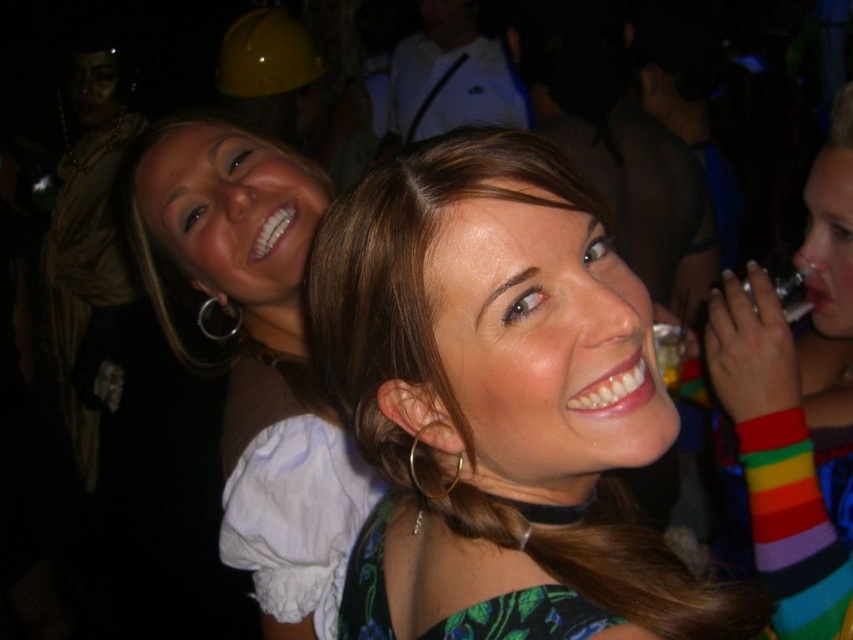
Question: Estimate the real-world distances between objects in this image. Which object is closer to the rainbow striped wristband at right?

Choices:
 (A) matte green dress at center
 (B) matte brown hair at center

Answer: (A)

Question: Is matte brown hair at center wider than rainbow striped wristband at right?

Choices:
 (A) yes
 (B) no

Answer: (A)

Question: Is the position of matte green dress at center more distant than that of matte brown hair at center?

Choices:
 (A) no
 (B) yes

Answer: (A)

Question: Estimate the real-world distances between objects in this image. Which object is farther from the matte brown hair at center?

Choices:
 (A) rainbow striped wristband at right
 (B) matte green dress at center

Answer: (A)

Question: Is matte brown hair at center positioned at the back of rainbow striped wristband at right?

Choices:
 (A) no
 (B) yes

Answer: (B)

Question: Which object appears closest to the camera in this image?

Choices:
 (A) rainbow striped wristband at right
 (B) matte green dress at center

Answer: (B)